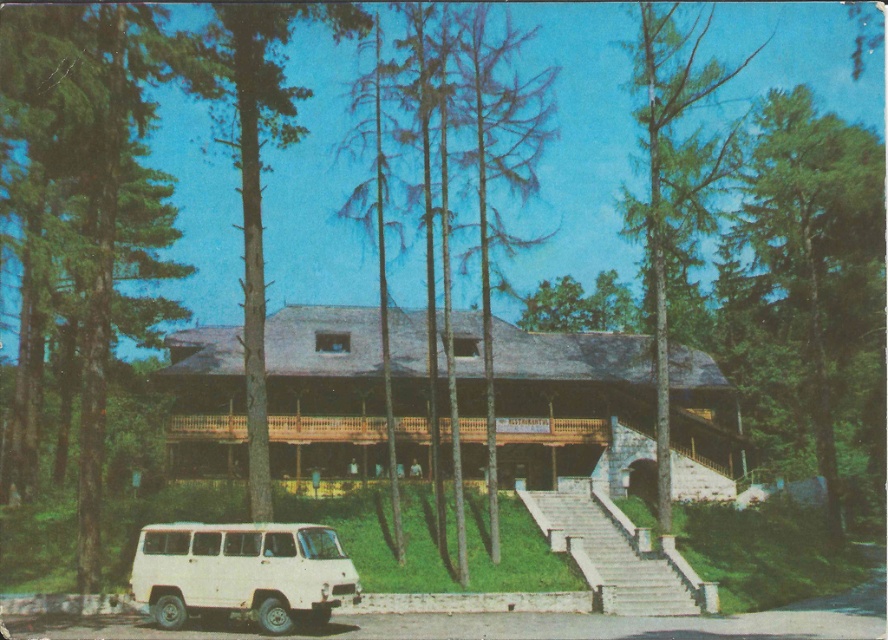
You are standing on the white stone stairs at center and want to reach the green textured tree at right. Which direction should you move to get closer to the tree?

The green textured tree at right is located above the white stone stairs at center, so you should move upward to get closer to the green textured tree at right.